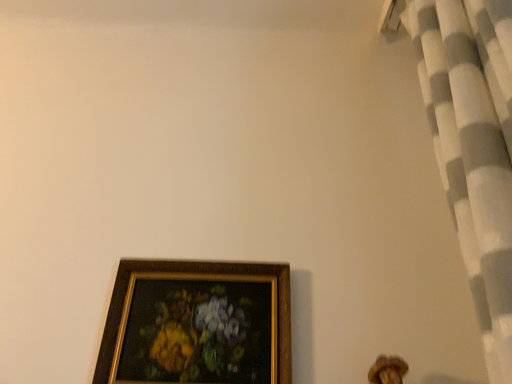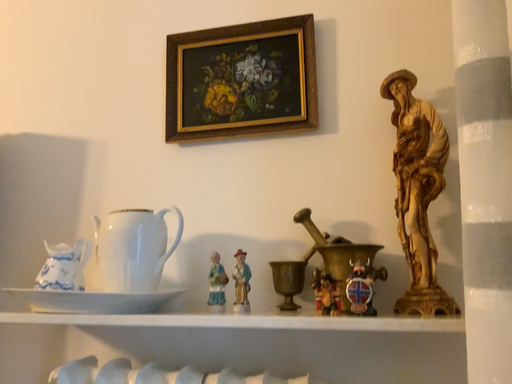
Question: How did the camera likely rotate when shooting the video?

Choices:
 (A) rotated upward
 (B) rotated downward

Answer: (B)